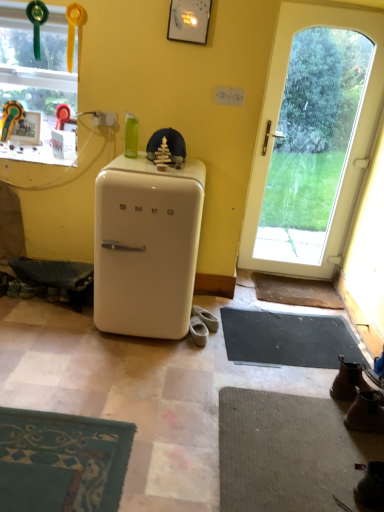
Question: From a real-world perspective, is white glass door at right on top of transparent glass window at upper left?

Choices:
 (A) no
 (B) yes

Answer: (A)

Question: Is transparent glass window at upper left located within white glass door at right?

Choices:
 (A) no
 (B) yes

Answer: (A)

Question: Does white glass door at right have a greater width compared to transparent glass window at upper left?

Choices:
 (A) yes
 (B) no

Answer: (B)

Question: From the image's perspective, is white glass door at right on transparent glass window at upper left?

Choices:
 (A) no
 (B) yes

Answer: (A)

Question: Considering the relative positions of white glass door at right and transparent glass window at upper left in the image provided, is white glass door at right behind transparent glass window at upper left?

Choices:
 (A) no
 (B) yes

Answer: (A)

Question: From the image's perspective, is brown leather boot at lower right, positioned as the 1th footwear in right-to-left order, positioned above or below white glass door at right?

Choices:
 (A) below
 (B) above

Answer: (A)

Question: Looking at the image, does brown leather boot at lower right, which appears as the third footwear when viewed from the left, seem bigger or smaller compared to white glass door at right?

Choices:
 (A) small
 (B) big

Answer: (A)

Question: Considering the positions of brown leather boot at lower right, the third footwear positioned from the top, and white glass door at right in the image, is brown leather boot at lower right, the third footwear positioned from the top, taller or shorter than white glass door at right?

Choices:
 (A) short
 (B) tall

Answer: (A)

Question: Is brown leather boot at lower right, the 1th footwear from the bottom, situated inside white glass door at right or outside?

Choices:
 (A) inside
 (B) outside

Answer: (B)

Question: Is beige suede shoes at lower center, which ranks as the third footwear in front-to-back order, in front of or behind beige suede shoes at lower center, the second footwear viewed from the back, in the image?

Choices:
 (A) front
 (B) behind

Answer: (B)

Question: Based on their positions, is beige suede shoes at lower center, the 2th footwear when ordered from right to left, located to the left or right of beige suede shoes at lower center, placed as the 1th footwear when sorted from left to right?

Choices:
 (A) left
 (B) right

Answer: (B)

Question: In terms of width, does beige suede shoes at lower center, the third footwear positioned from the bottom, look wider or thinner when compared to beige suede shoes at lower center, the 2th footwear positioned from the front?

Choices:
 (A) thin
 (B) wide

Answer: (B)

Question: Would you say beige suede shoes at lower center, acting as the 2th footwear starting from the left, is inside or outside beige suede shoes at lower center, the 2th footwear positioned from the front?

Choices:
 (A) outside
 (B) inside

Answer: (A)

Question: Considering the relative positions of black rubber yoga mat at lower right and brown leather doormat at lower right in the image provided, is black rubber yoga mat at lower right to the left or to the right of brown leather doormat at lower right?

Choices:
 (A) left
 (B) right

Answer: (A)

Question: Is black rubber yoga mat at lower right inside or outside of brown leather doormat at lower right?

Choices:
 (A) outside
 (B) inside

Answer: (A)